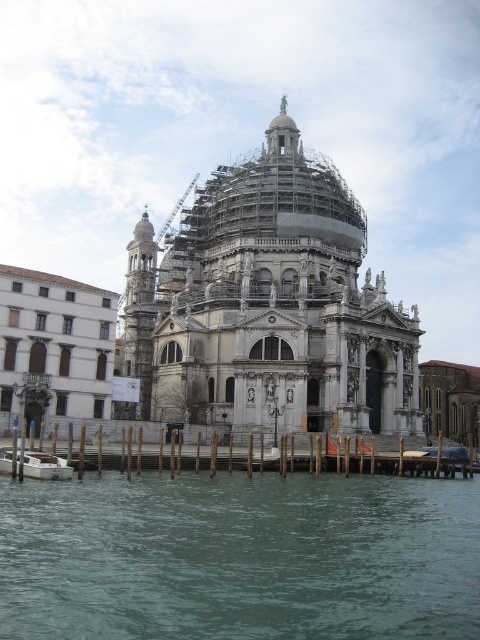
You are standing on the dock near the white glossy boat at lower left and want to cross to the other side of the greenish water at lower center. The boat is the only means of transportation available. Can you use the boat to cross the water?

The greenish water at lower center might be wider than white glossy boat at lower left, so the boat may not be long enough to span the width of the water. Therefore, it might not be possible to cross using the boat.

You are an architect visiting this historic site. You notice the white marble dome at center and the wooden planks at lower center. Which object is higher in elevation?

The white marble dome at center is taller than the wooden planks at lower center.